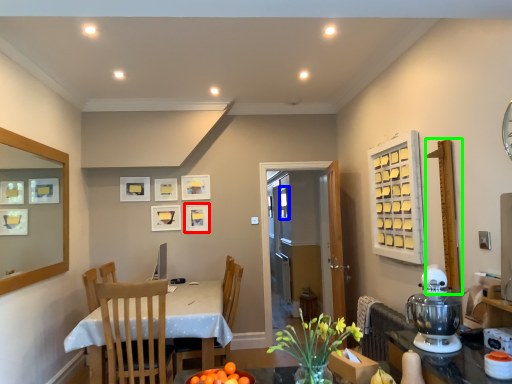
Question: Which is farther away from picture frame (highlighted by a red box)? window (highlighted by a blue box) or bulletin board (highlighted by a green box)?

Choices:
 (A) window
 (B) bulletin board

Answer: (B)